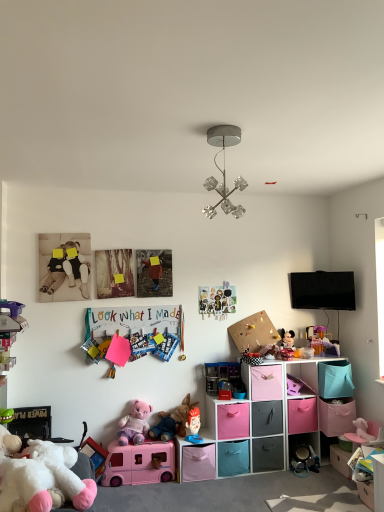
Question: Does matte plastic toy at center, which appears as the sixth toy when viewed from the front, have a larger size compared to pastel fabric storage cubes at center?

Choices:
 (A) no
 (B) yes

Answer: (A)

Question: Is matte plastic toy at center, which appears as the sixth toy when viewed from the front, to the left of pastel fabric storage cubes at center from the viewer's perspective?

Choices:
 (A) no
 (B) yes

Answer: (B)

Question: From a real-world perspective, is matte plastic toy at center, arranged as the 6th toy when viewed from the back, beneath pastel fabric storage cubes at center?

Choices:
 (A) no
 (B) yes

Answer: (B)

Question: Is matte plastic toy at center, arranged as the 6th toy when viewed from the back, looking in the opposite direction of pastel fabric storage cubes at center?

Choices:
 (A) no
 (B) yes

Answer: (B)

Question: From the image's perspective, does matte plastic toy at center, which appears as the sixth toy when viewed from the front, appear higher than pastel fabric storage cubes at center?

Choices:
 (A) yes
 (B) no

Answer: (B)

Question: In terms of size, does pink fabric drawer at lower center, marked as the fourth drawer in a top-to-bottom arrangement, appear bigger or smaller than multicolored paper at upper center, arranged as the fifth toy when viewed from the back?

Choices:
 (A) small
 (B) big

Answer: (B)

Question: From the image's perspective, is pink fabric drawer at lower center, marked as the fourth drawer in a top-to-bottom arrangement, above or below multicolored paper at upper center, arranged as the fifth toy when viewed from the back?

Choices:
 (A) above
 (B) below

Answer: (B)

Question: Based on their positions, is pink fabric drawer at lower center, marked as the fourth drawer in a top-to-bottom arrangement, located to the left or right of multicolored paper at upper center, arranged as the fifth toy when viewed from the back?

Choices:
 (A) left
 (B) right

Answer: (B)

Question: From a real-world perspective, is pink fabric drawer at lower center, marked as the fourth drawer in a top-to-bottom arrangement, positioned above or below multicolored paper at upper center, which appears as the seventh toy when viewed from the front?

Choices:
 (A) below
 (B) above

Answer: (A)

Question: Would you say pink fabric drawer at lower center, marked as the fourth drawer in a top-to-bottom arrangement, is inside or outside translucent plastic container at upper right, the second toy viewed from the back?

Choices:
 (A) inside
 (B) outside

Answer: (B)

Question: Considering the positions of pink fabric drawer at lower center, positioned as the third drawer in bottom-to-top order, and translucent plastic container at upper right, the second toy viewed from the back, in the image, is pink fabric drawer at lower center, positioned as the third drawer in bottom-to-top order, bigger or smaller than translucent plastic container at upper right, the second toy viewed from the back,?

Choices:
 (A) small
 (B) big

Answer: (B)

Question: From a real-world perspective, is pink fabric drawer at lower center, marked as the fourth drawer in a top-to-bottom arrangement, positioned above or below translucent plastic container at upper right, the second toy viewed from the back?

Choices:
 (A) below
 (B) above

Answer: (A)

Question: In terms of height, does pink fabric drawer at lower center, marked as the fourth drawer in a top-to-bottom arrangement, look taller or shorter compared to translucent plastic container at upper right, which is the tenth toy from front to back?

Choices:
 (A) short
 (B) tall

Answer: (B)

Question: From their relative heights in the image, would you say white plush toy at lower left, positioned as the first toy in front-to-back order, is taller or shorter than translucent plastic container at upper right, which is the tenth toy from front to back?

Choices:
 (A) short
 (B) tall

Answer: (B)

Question: Considering the relative positions of white plush toy at lower left, the 11th toy from the back, and translucent plastic container at upper right, which is the tenth toy from front to back, in the image provided, is white plush toy at lower left, the 11th toy from the back, to the left or to the right of translucent plastic container at upper right, which is the tenth toy from front to back,?

Choices:
 (A) right
 (B) left

Answer: (B)